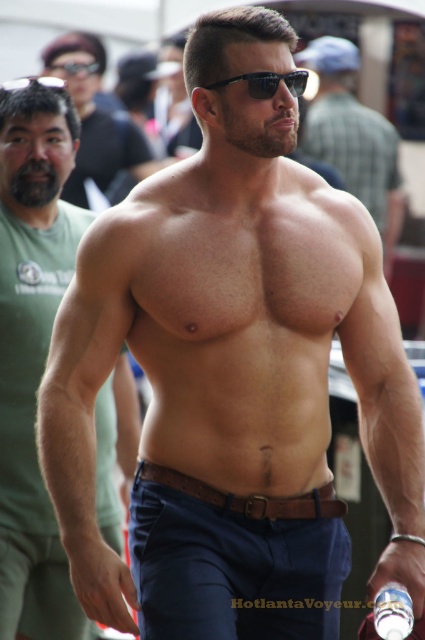
You are a photographer trying to capture the muscular skin at center in the image. Based on its position coordinates, where should you focus your camera lens to ensure it is centered in the frame?

The muscular skin at center is located at coordinates point (353,136), so you should focus your camera lens at that point to center it in the frame.

You are a fashion designer observing the man at the event. You need to decide which accessory to adjust first based on their size. Which one should you focus on first, the matte brown belt at center or the sunglasses at center?

The matte brown belt at center is bigger than the sunglasses at center, so you should focus on adjusting the matte brown belt at center first since it is larger and may require more attention.

You are a fashion designer observing the man in the image. You need to determine which item is taller between the matte brown belt at center and the sunglasses at center. Which one is taller?

The matte brown belt at center is taller than the sunglasses at center.